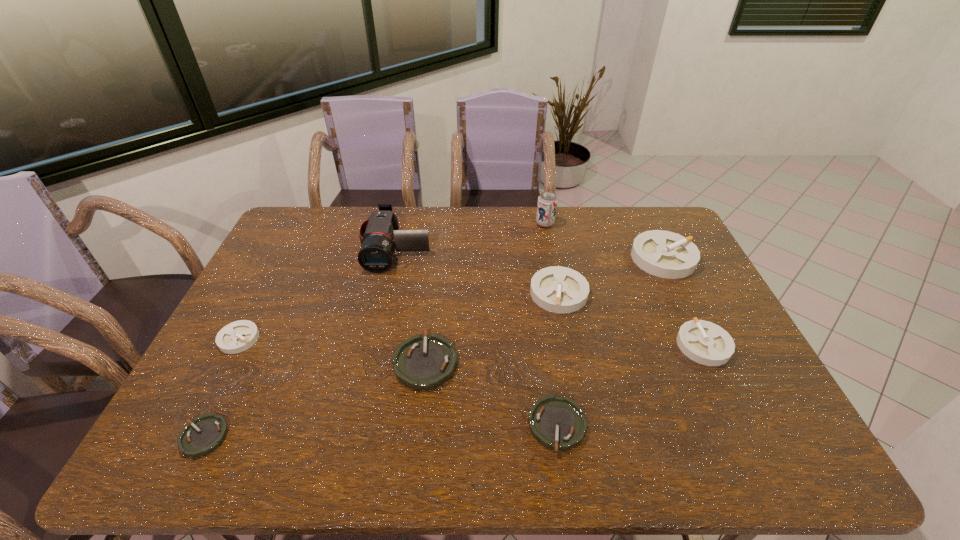
You are a GUI agent. You are given a task and a screenshot of the screen. Output one action in this format:
    pyautogui.click(x=<x>, y=<y>)
    Task: Click on the free space between the second smallest green ashtray and the second biggest gray ashtray
    This screenshot has height=540, width=960.
    Given the screenshot: What is the action you would take?
    pyautogui.click(x=558, y=359)

Select which object appears as the second closest to the beer can. Please provide its 2D coordinates. Your answer should be formatted as a tuple, i.e. [(x, y)], where the tuple contains the x and y coordinates of a point satisfying the conditions above.

[(557, 289)]

Image resolution: width=960 pixels, height=540 pixels. In order to click on object that stands as the seventh closest to the third tallest ashtray in this screenshot , I will do `click(207, 432)`.

You are a GUI agent. You are given a task and a screenshot of the screen. Output one action in this format:
    pyautogui.click(x=<x>, y=<y>)
    Task: Click on the ashtray that is the sixth closest to the beer can
    
    Given the screenshot: What is the action you would take?
    pyautogui.click(x=238, y=336)

Identify which ashtray is located as the second nearest to the camcorder. Please provide its 2D coordinates. Your answer should be formatted as a tuple, i.e. [(x, y)], where the tuple contains the x and y coordinates of a point satisfying the conditions above.

[(238, 336)]

Locate which gray ashtray ranks in proximity to the shortest object. Please provide its 2D coordinates. Your answer should be formatted as a tuple, i.e. [(x, y)], where the tuple contains the x and y coordinates of a point satisfying the conditions above.

[(238, 336)]

This screenshot has width=960, height=540. I want to click on gray ashtray that stands as the closest to the second biggest green ashtray, so click(x=557, y=289).

Locate which green ashtray ranks in proximity to the third tallest ashtray. Please provide its 2D coordinates. Your answer should be formatted as a tuple, i.e. [(x, y)], where the tuple contains the x and y coordinates of a point satisfying the conditions above.

[(558, 423)]

Locate which green ashtray ranks in proximity to the seventh shortest object. Please provide its 2D coordinates. Your answer should be formatted as a tuple, i.e. [(x, y)], where the tuple contains the x and y coordinates of a point satisfying the conditions above.

[(558, 423)]

At what (x,y) coordinates should I click in order to perform the action: click on vacant space that satisfies the following two spatial constraints: 1. on the back side of the tallest ashtray; 2. on the left side of the leftmost gray ashtray. Please return your answer as a coordinate pair (x, y). Looking at the image, I should click on (281, 258).